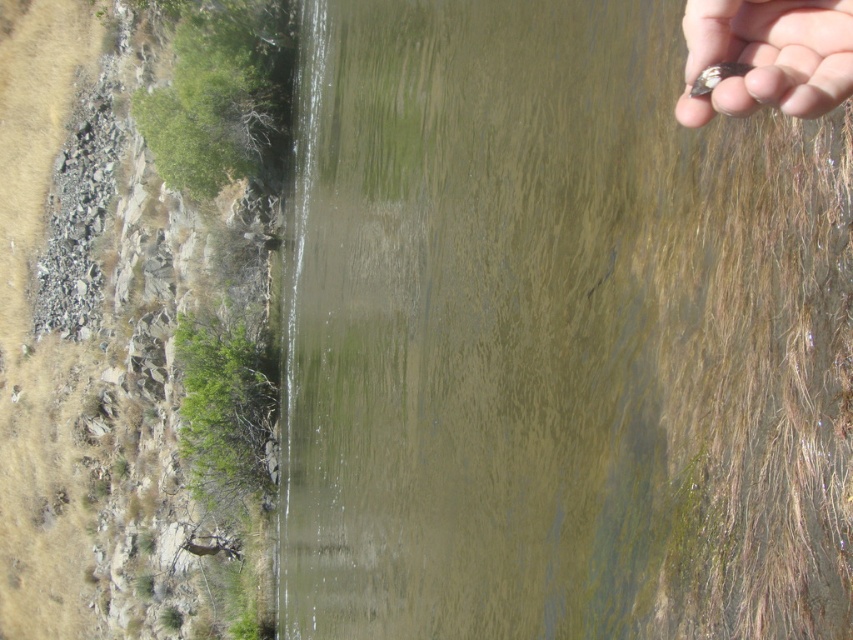
Question: Is greenish murky water at upper center to the left of rocks at left from the viewer's perspective?

Choices:
 (A) yes
 (B) no

Answer: (B)

Question: Among these objects, which one is farthest from the camera?

Choices:
 (A) smooth skin hand at upper right
 (B) rocks at left
 (C) greenish murky water at upper center

Answer: (B)

Question: Which point is closer to the camera taking this photo?

Choices:
 (A) click(111, 625)
 (B) click(788, 44)
 (C) click(322, 51)

Answer: (B)

Question: Does greenish murky water at upper center appear on the left side of rocks at left?

Choices:
 (A) yes
 (B) no

Answer: (B)

Question: Which point is closer to the camera taking this photo?

Choices:
 (A) (38, 598)
 (B) (694, 100)

Answer: (B)

Question: Does rocks at left appear under smooth skin hand at upper right?

Choices:
 (A) yes
 (B) no

Answer: (A)